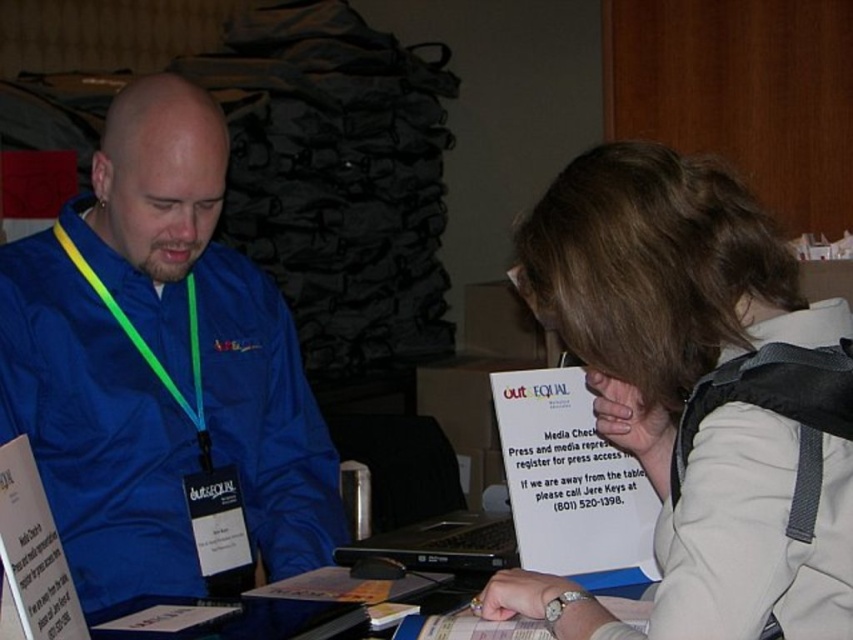
You are sitting at the table and want to reach the item located at point (506, 536). Is this point closer to you than point (115, 323)?

Yes, point (506, 536) is in front of point (115, 323), so it is closer to you.

You are a photographer taking a group photo of the people at the table. You need to arrange them so that the blue fabric jacket at left and the light beige fabric jacket at lower right are visible in the frame. Which jacket should be placed to the left side of the other to match their current positions?

The blue fabric jacket at left should be placed to the left side of the light beige fabric jacket at lower right because the blue fabric jacket at left is positioned on the left side of the light beige fabric jacket at lower right in the current scene.